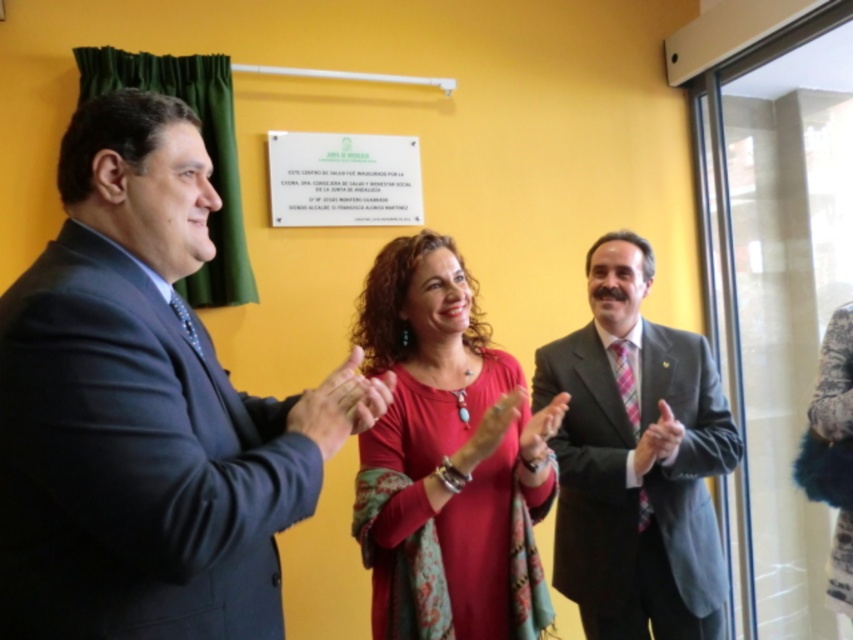
You are attending a formal event and notice two attendees dressed in a matte red dress at center and a smooth black suit at center. From your perspective, which one is positioned to the left?

The matte red dress at center is positioned to the left of the smooth black suit at center.

You are an event photographer who needs to capture a clear shot of both the fuzzy gray coat at center and the smooth skin hand at center. Since you want to ensure both are in focus, you need to know their positions relative to each other. Based on the scene, which object is positioned to the right of the other?

The fuzzy gray coat at center is to the right of the smooth skin hand at center.

You are at a formal event and need to find the person wearing the matte black suit at left. Which direction should you look relative to the person in the matte gray suit at center?

The matte black suit at left is positioned on the left side of the matte gray suit at center, so you should look to the left of the person in the matte gray suit at center to find the matte black suit at left.